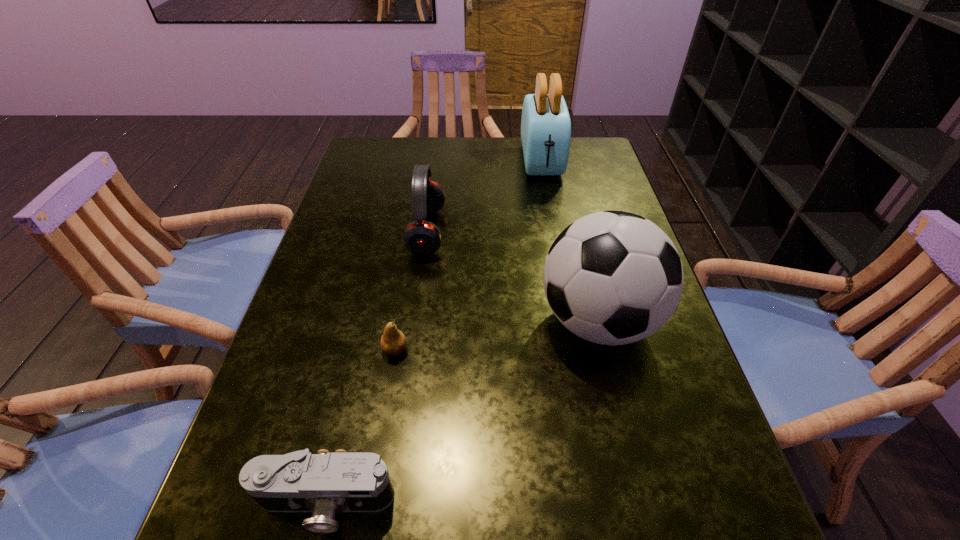
Where is `free spot between the camera and the toaster`? This screenshot has width=960, height=540. free spot between the camera and the toaster is located at coordinates (434, 332).

Find the location of a particular element. The image size is (960, 540). vacant point located between the farthest object and the nearest object is located at coordinates (434, 332).

Locate an element on the screen. free space between the soccer ball and the camera is located at coordinates (462, 411).

This screenshot has height=540, width=960. In order to click on vacant area that lies between the pear and the farthest object in this screenshot , I will do `click(468, 255)`.

The image size is (960, 540). In order to click on vacant area that lies between the soccer ball and the nearest object in this screenshot , I will do `click(462, 411)`.

The height and width of the screenshot is (540, 960). In order to click on vacant area that lies between the nearest object and the soccer ball in this screenshot , I will do pos(462,411).

Locate an element on the screen. Image resolution: width=960 pixels, height=540 pixels. vacant area that lies between the third tallest object and the soccer ball is located at coordinates (513, 276).

The width and height of the screenshot is (960, 540). Identify the location of free space between the soccer ball and the pear. (496, 335).

This screenshot has width=960, height=540. Find the location of `unoccupied area between the pear and the nearest object`. unoccupied area between the pear and the nearest object is located at coordinates (360, 427).

Where is `the closest object to the soccer ball`? The width and height of the screenshot is (960, 540). the closest object to the soccer ball is located at coordinates (421, 237).